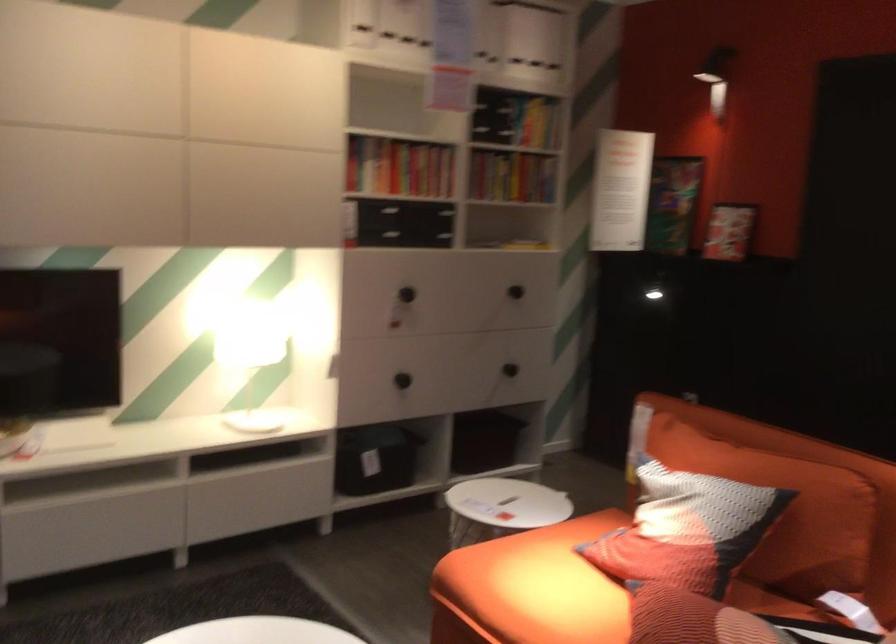
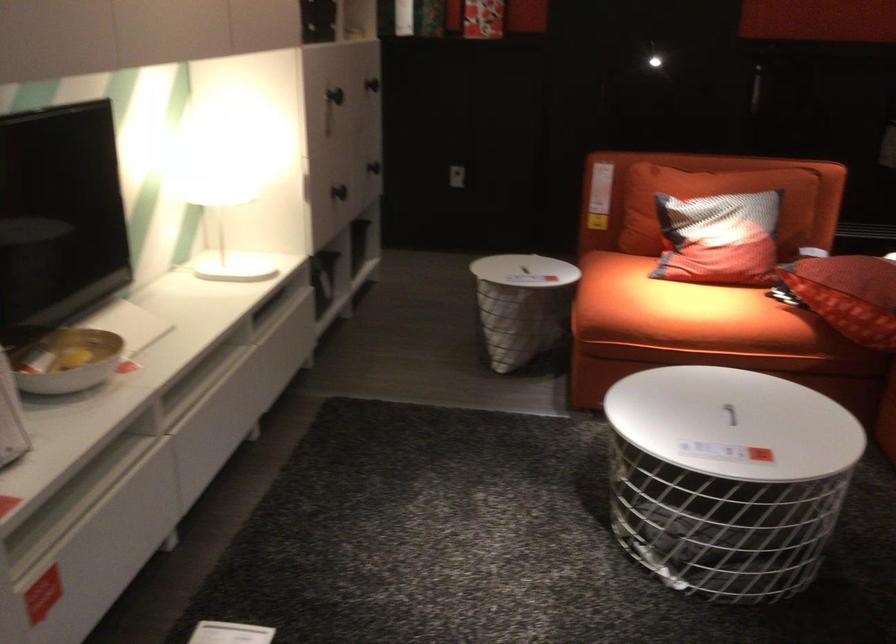
Find the pixel in the second image that matches point 512,363 in the first image.

(373, 167)